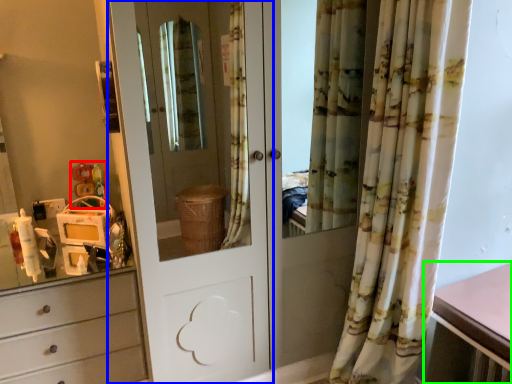
Question: Based on their relative distances, which object is farther from toy (highlighted by a red box)? Choose from door (highlighted by a blue box) and table (highlighted by a green box).

Choices:
 (A) door
 (B) table

Answer: (B)